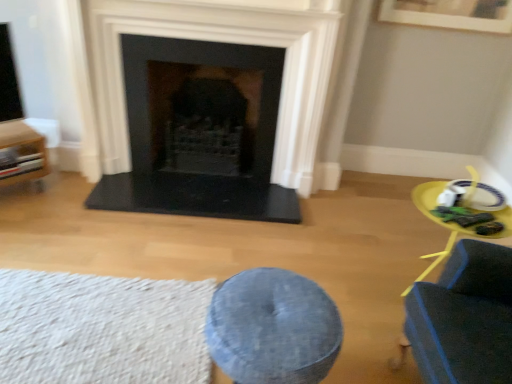
Question: Considering their positions, is black stone fireplace at center located in front of or behind white textured rug at lower left?

Choices:
 (A) behind
 (B) front

Answer: (A)

Question: Visually, is black stone fireplace at center positioned to the left or to the right of white textured rug at lower left?

Choices:
 (A) left
 (B) right

Answer: (B)

Question: Which object is the farthest from the yellow plastic table at right?

Choices:
 (A) wooden cabinet at left
 (B) white textured rug at lower left
 (C) denim cushion at center
 (D) black stone fireplace at center

Answer: (A)

Question: Which is farther from the denim cushion at center?

Choices:
 (A) wooden cabinet at left
 (B) yellow plastic table at right
 (C) white textured rug at lower left
 (D) black stone fireplace at center

Answer: (A)